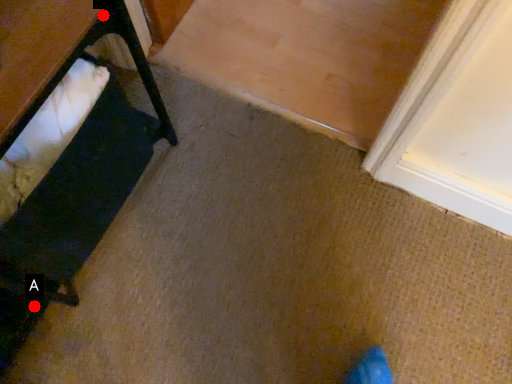
Question: Two points are circled on the image, labeled by A and B beside each circle. Which point is farther from the camera taking this photo?

Choices:
 (A) A is further
 (B) B is further

Answer: (A)